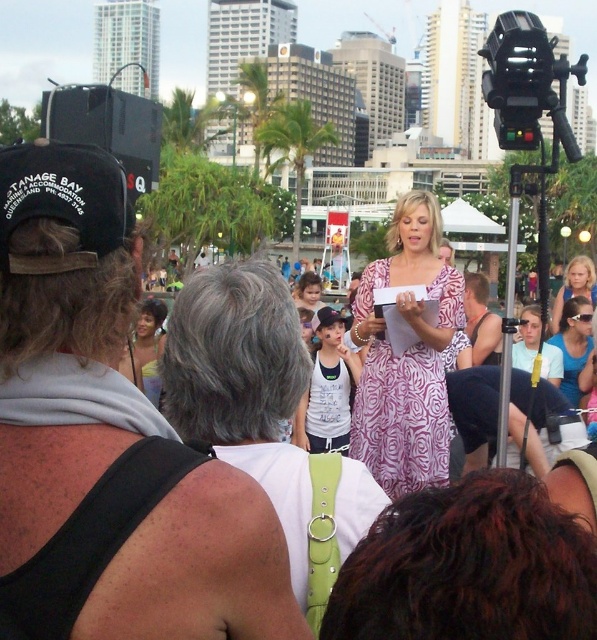
Who is positioned more to the left, white floral dress at center or yellow fabric dress at center?

yellow fabric dress at center

Who is positioned more to the right, white floral dress at center or yellow fabric dress at center?

white floral dress at center

Find the location of a particular element. white floral dress at center is located at coordinates (63, 257).

Who is taller, blue fabric sunglasses at center or matte pink dress at center?

With more height is blue fabric sunglasses at center.

Measure the distance between blue fabric sunglasses at center and matte pink dress at center.

blue fabric sunglasses at center and matte pink dress at center are 94.05 feet apart from each other.

Is point (590, 348) more distant than point (316, 273)?

No, it is not.

The image size is (597, 640). I want to click on blue fabric sunglasses at center, so click(x=573, y=342).

Does point (555, 321) lie in front of point (319, 292)?

Yes, point (555, 321) is in front of point (319, 292).

You are a GUI agent. You are given a task and a screenshot of the screen. Output one action in this format:
    pyautogui.click(x=<x>, y=<y>)
    Task: Click on the light blue denim shorts at center
    
    Given the screenshot: What is the action you would take?
    pyautogui.click(x=574, y=285)